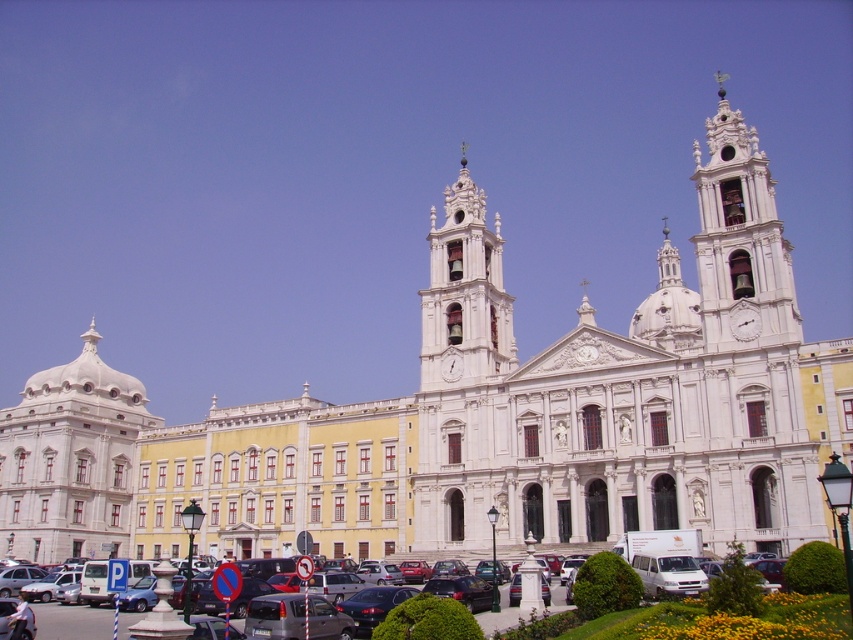
Alright, let me tackle this step by step. First, I need to generate a question and answer based on the provided scene, objects, and their descriptions. Starting with the Scene description. The image is of a grand building with two towers, probably a cathedral. It mentions white marble dome at left and a white ornate clock tower at center. The Objects Description says the dome might be wider than the clock tower. The rules state that the question must include both object labels exactly as given. The

Okay, the user provided a scene of a cathedral with two towers. The objects are the white marble dome at left and the white ornate clock tower at center. The description says the dome might be wider than the clock tower. First, I need to form a question that doesnates the observer to compare their widths without revealing the answer. The question should mention both objects. Maybe something like asking which one is wider. Wait, but the answer has to use the Objects Description. Since the dome

You are a tourist standing in front of the cathedral and want to take a photo of both the white ornate clock tower at center and the matte black car at center. Which object should you frame first in your camera to ensure both fit in the photo?

The white ornate clock tower at center has a lesser width compared to the matte black car at center, so you should frame the matte black car at center first since it is wider and requires more space in the photo to ensure both objects fit properly.

You are standing at the entrance of the grand building and want to locate the white ornate clock tower at center. According to the building layout, where exactly is it positioned?

The white ornate clock tower at center is positioned at point 0.459 on the x axis and 0.545 on the y axis.